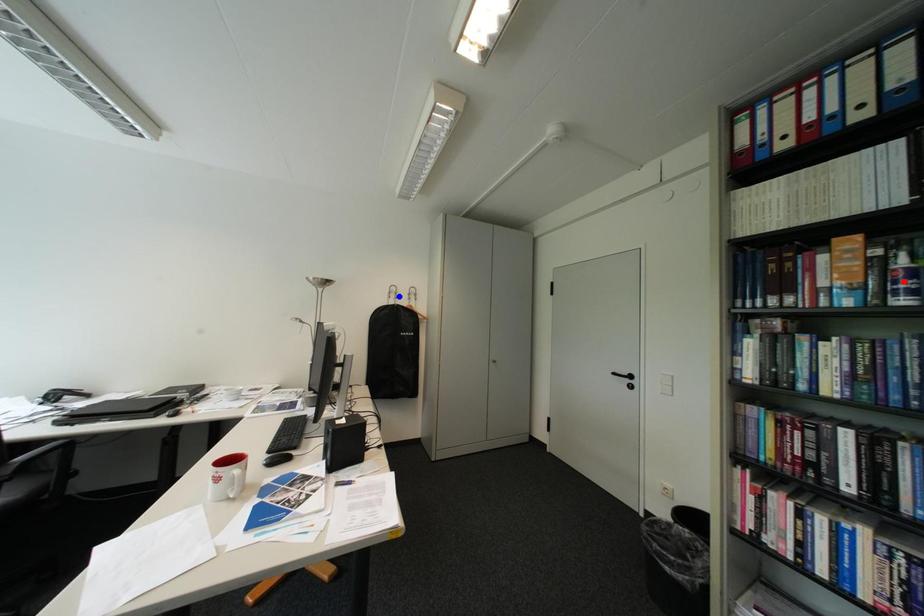
Question: Which of the two points in the image is closer to the camera?

Choices:
 (A) Blue point is closer.
 (B) Red point is closer.

Answer: (B)